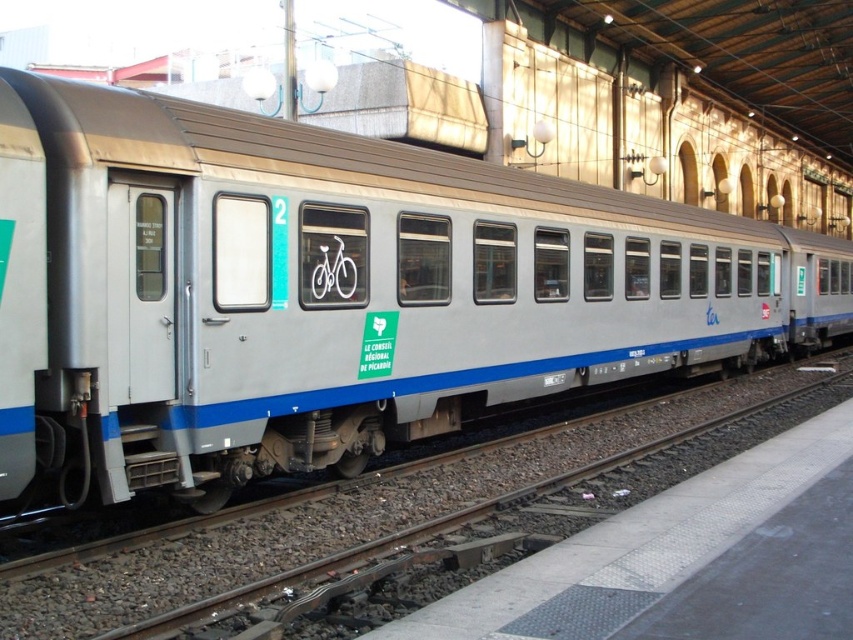
Does metallic silver train at center have a smaller size compared to metal track at lower left?

No, metallic silver train at center is not smaller than metal track at lower left.

Consider the image. Who is more distant from viewer, [839,268] or [500,452]?

The point [839,268] is more distant.

This screenshot has width=853, height=640. I want to click on metallic silver train at center, so click(x=332, y=291).